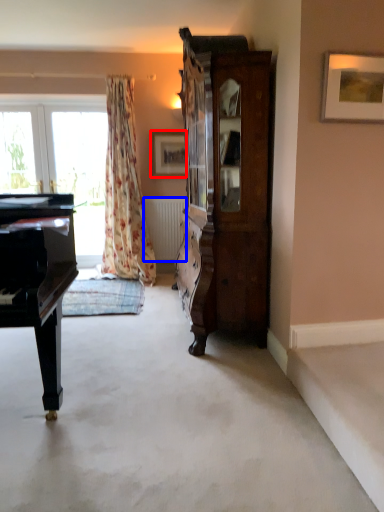
Question: Among these objects, which one is farthest to the camera, picture frame (highlighted by a red box) or radiator (highlighted by a blue box)?

Choices:
 (A) picture frame
 (B) radiator

Answer: (B)